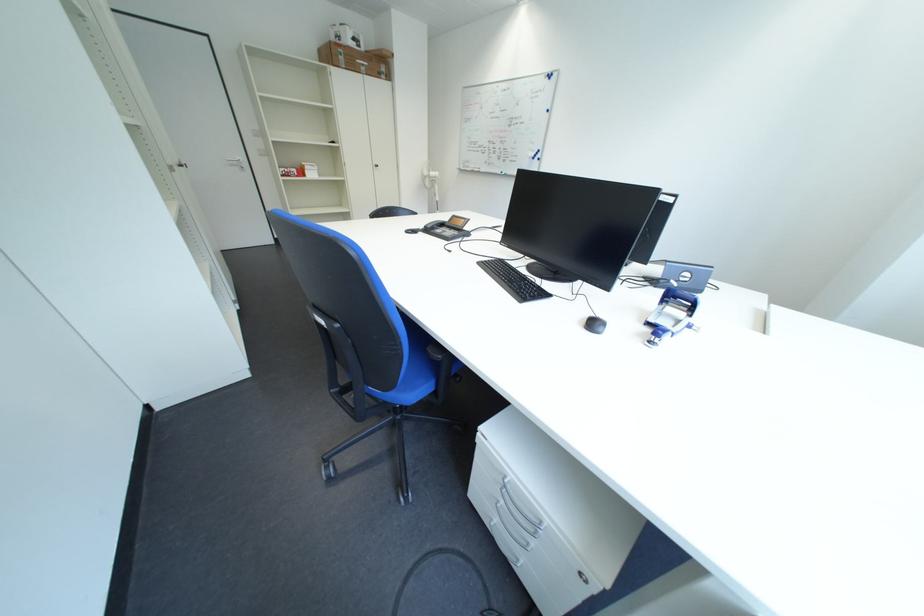
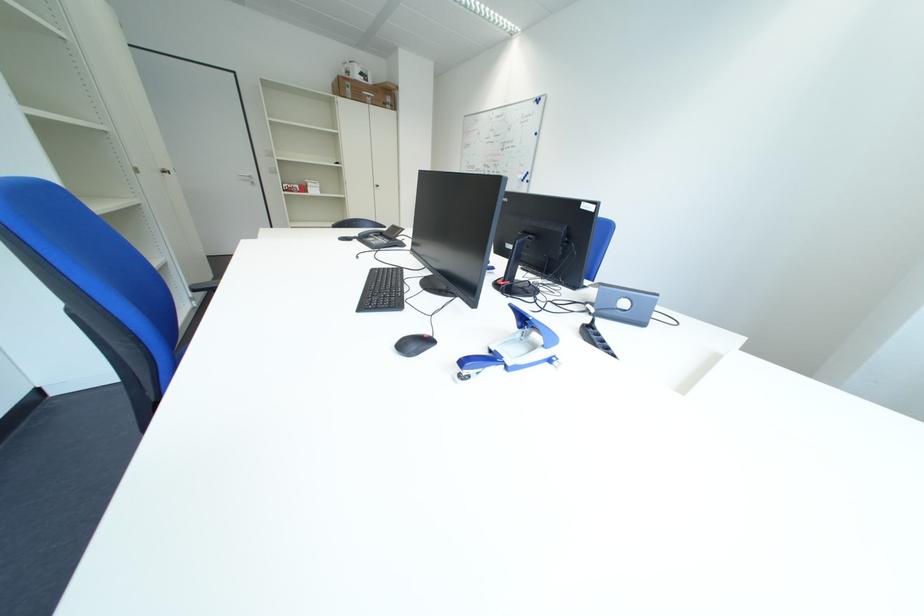
Where in the second image is the point corresponding to [354,61] from the first image?

(360, 92)